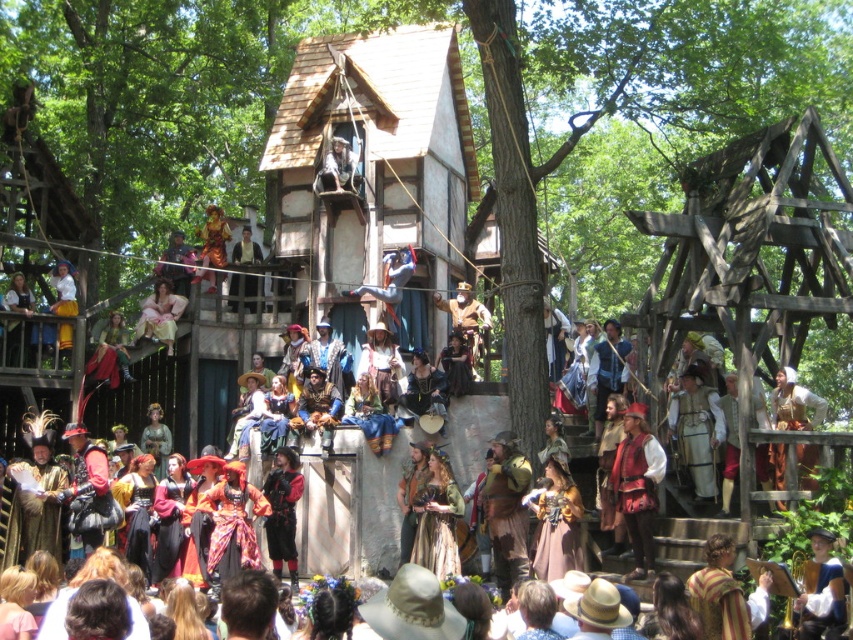
Which is below, light brown leather vest at center or golden fabric dress at center?

Positioned lower is golden fabric dress at center.

Between light brown leather vest at center and golden fabric dress at center, which one has more height?

With more height is golden fabric dress at center.

Does point (676, 433) lie behind point (550, 577)?

Yes.

This screenshot has height=640, width=853. What are the coordinates of `light brown leather vest at center` in the screenshot? It's located at (697, 429).

Does brown leather vest at upper right have a larger size compared to blue velvet hat at center?

Yes.

Is point (785, 428) less distant than point (810, 605)?

That is False.

This screenshot has width=853, height=640. Identify the location of brown leather vest at upper right. (793, 403).

Is brown leather vest at upper right in front of velvet red vest at center?

Yes.

Who is positioned more to the right, brown leather vest at upper right or velvet red vest at center?

From the viewer's perspective, brown leather vest at upper right appears more on the right side.

The width and height of the screenshot is (853, 640). In order to click on brown leather vest at upper right in this screenshot , I will do `click(793, 403)`.